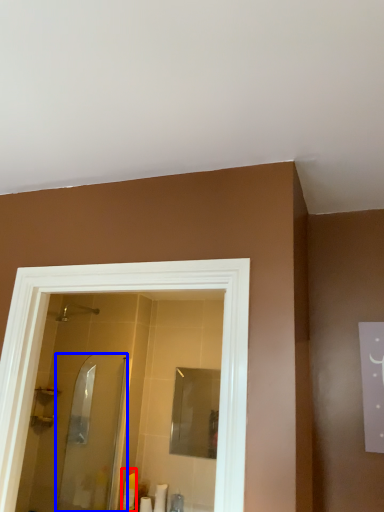
Question: Which point is closer to the camera, toiletry (highlighted by a red box) or screen door (highlighted by a blue box)?

Choices:
 (A) toiletry
 (B) screen door

Answer: (B)